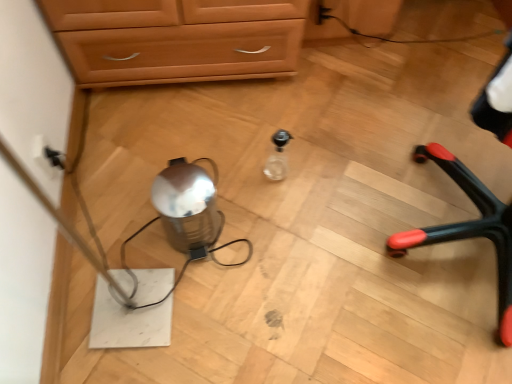
Question: From the image's perspective, is black plastic chair legs at right above or below black plastic electric outlet at left?

Choices:
 (A) above
 (B) below

Answer: (B)

Question: From a real-world perspective, is black plastic chair legs at right positioned above or below black plastic electric outlet at left?

Choices:
 (A) below
 (B) above

Answer: (B)

Question: Estimate the real-world distances between objects in this image. Which object is closer to the black plastic electric outlet at left?

Choices:
 (A) transparent glass bottle at center
 (B) black plastic chair legs at right
 (C) shiny metallic kettle at center

Answer: (C)

Question: Estimate the real-world distances between objects in this image. Which object is farther from the black plastic electric outlet at left?

Choices:
 (A) transparent glass bottle at center
 (B) black plastic chair legs at right
 (C) shiny metallic kettle at center

Answer: (B)